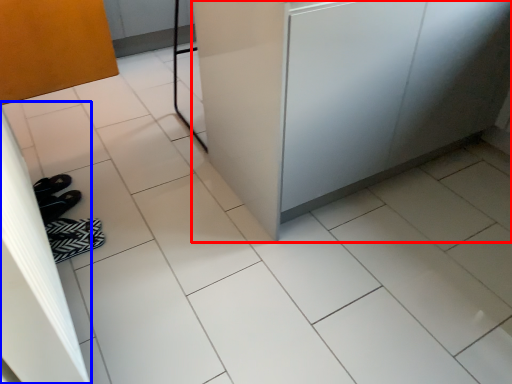
Question: Which object appears farthest to the camera in this image, counter (highlighted by a red box) or screen door (highlighted by a blue box)?

Choices:
 (A) counter
 (B) screen door

Answer: (A)